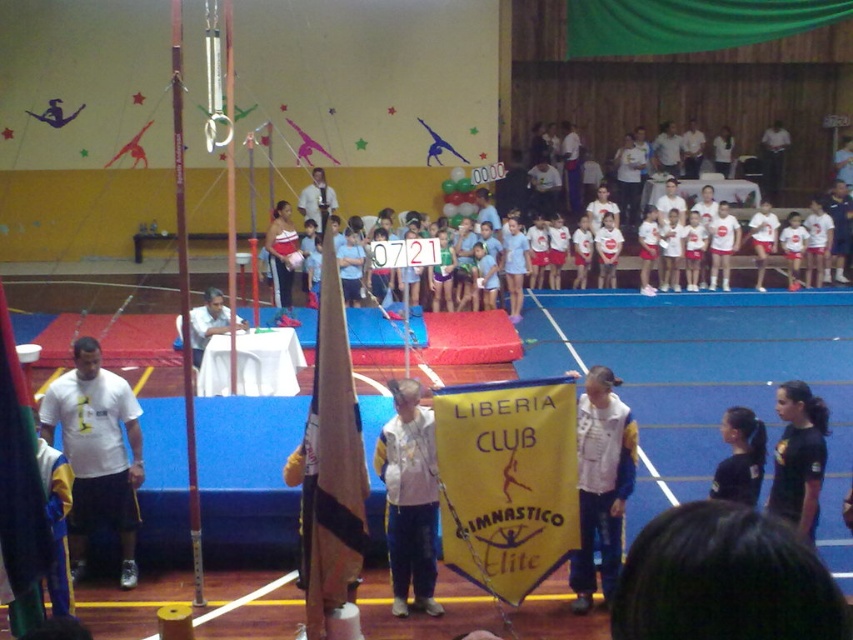
Question: Which point appears farthest from the camera in this image?

Choices:
 (A) (782, 515)
 (B) (610, 589)

Answer: (B)

Question: Is white textured jacket at center below matte white tank top at center?

Choices:
 (A) no
 (B) yes

Answer: (B)

Question: Among these objects, which one is farthest from the camera?

Choices:
 (A) white fabric at center
 (B) white/yellow jacket at center
 (C) black fabric hair at lower right
 (D) white matte t-shirt at center

Answer: (A)

Question: Observing the image, what is the correct spatial positioning of brown fabric flag at center in reference to matte white tank top at center?

Choices:
 (A) below
 (B) above

Answer: (A)

Question: Does white/yellow jacket at center appear under black fabric hair at lower right?

Choices:
 (A) no
 (B) yes

Answer: (B)

Question: Estimate the real-world distances between objects in this image. Which object is farther from the white fabric at center?

Choices:
 (A) white matte t-shirt at center
 (B) white/yellow jacket at center

Answer: (B)